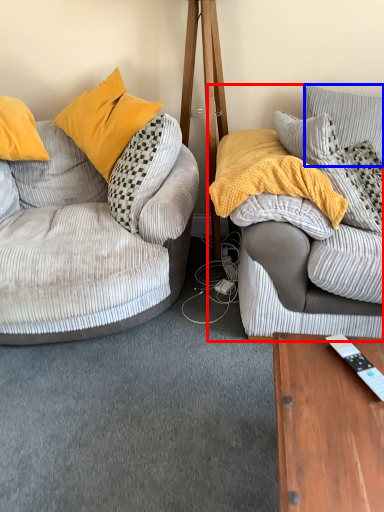
Question: Which object appears closest to the camera in this image, studio couch (highlighted by a red box) or pillow (highlighted by a blue box)?

Choices:
 (A) studio couch
 (B) pillow

Answer: (A)